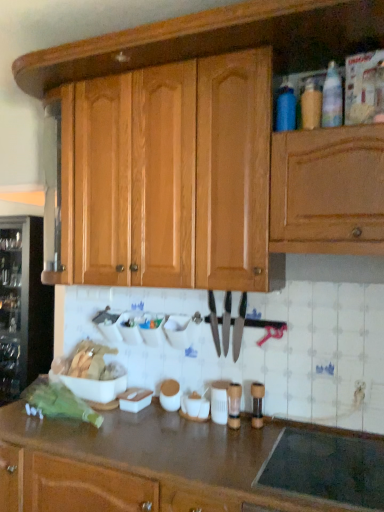
You are a GUI agent. You are given a task and a screenshot of the screen. Output one action in this format:
    pyautogui.click(x=<x>, y=<y>)
    Task: Click on the translucent plastic bottle at upper right, placed as the first bottle when sorted from right to left
    
    Given the screenshot: What is the action you would take?
    pyautogui.click(x=332, y=97)

Measure the distance between translucent plastic bottle at upper right, the 2th bottle in the left-to-right sequence, and camera.

translucent plastic bottle at upper right, the 2th bottle in the left-to-right sequence, is 1.56 meters away from camera.

This screenshot has width=384, height=512. I want to click on shiny silver knife at center, so click(239, 327).

Image resolution: width=384 pixels, height=512 pixels. What do you see at coordinates (214, 322) in the screenshot? I see `shiny silver knife at center, arranged as the first knife when viewed from the left` at bounding box center [214, 322].

Measure the distance between wooden cabinet at upper center and camera.

→ The depth of wooden cabinet at upper center is 5.16 feet.

What are the coordinates of `brown laminate countertop at lower center` in the screenshot? It's located at 182,465.

Which of these two, black metallic knife at center, the 2th knife in the left-to-right sequence, or wooden cabinet at upper center, is bigger?

Bigger between the two is wooden cabinet at upper center.

From the image's perspective, which one is positioned higher, black metallic knife at center, the 2th knife in the left-to-right sequence, or wooden cabinet at upper center?

From the image's view, wooden cabinet at upper center is above.

Would you say black metallic knife at center, the 2th knife in the left-to-right sequence, is inside or outside wooden cabinet at upper center?

black metallic knife at center, the 2th knife in the left-to-right sequence, is not inside wooden cabinet at upper center, it's outside.

Would you say shiny silver knife at center, arranged as the first knife when viewed from the left, is part of wooden cabinet at upper center's contents?

No, shiny silver knife at center, arranged as the first knife when viewed from the left, is located outside of wooden cabinet at upper center.

Which of these two, wooden cabinet at upper center or shiny silver knife at center, which appears as the second knife when viewed from the right, stands taller?

wooden cabinet at upper center.

Does point (108, 98) come in front of point (211, 308)?

Yes, point (108, 98) is closer to viewer.

Would you say wooden cabinet at upper center is a long distance from shiny silver knife at center, arranged as the first knife when viewed from the left?

No, wooden cabinet at upper center is not far from shiny silver knife at center, arranged as the first knife when viewed from the left.

Which of these two, black glass stovetop at lower right or black metallic knife at center, which appears as the first knife when viewed from the right, stands taller?

With more height is black metallic knife at center, which appears as the first knife when viewed from the right.

This screenshot has height=512, width=384. Find the location of `appliance in front of the black metallic knife at center, the 2th knife in the left-to-right sequence`. appliance in front of the black metallic knife at center, the 2th knife in the left-to-right sequence is located at coordinates (327, 467).

Considering the relative sizes of black glass stovetop at lower right and black metallic knife at center, the 2th knife in the left-to-right sequence, in the image provided, is black glass stovetop at lower right wider than black metallic knife at center, the 2th knife in the left-to-right sequence,?

Answer: Indeed, black glass stovetop at lower right has a greater width compared to black metallic knife at center, the 2th knife in the left-to-right sequence.

Who is smaller, black glass stovetop at lower right or black metallic knife at center, the 2th knife in the left-to-right sequence?

black metallic knife at center, the 2th knife in the left-to-right sequence, is smaller.

Is the position of black metallic knife at center, which appears as the first knife when viewed from the right, more distant than that of shiny silver knife at center?

Yes, black metallic knife at center, which appears as the first knife when viewed from the right, is further from the viewer.

How much distance is there between black metallic knife at center, which appears as the first knife when viewed from the right, and shiny silver knife at center?

The distance of black metallic knife at center, which appears as the first knife when viewed from the right, from shiny silver knife at center is 0.98 inches.

From a real-world perspective, which object rests below the other?

shiny silver knife at center.

Considering the positions of objects black metallic knife at center, the 2th knife in the left-to-right sequence, and shiny silver knife at center in the image provided, who is more to the right, black metallic knife at center, the 2th knife in the left-to-right sequence, or shiny silver knife at center?

shiny silver knife at center.

From the image's perspective, is translucent plastic bottle at upper right, the 3th bottle in the left-to-right sequence, located beneath brown laminate countertop at lower center?

Actually, translucent plastic bottle at upper right, the 3th bottle in the left-to-right sequence, appears above brown laminate countertop at lower center in the image.

Which is farther, (335, 101) or (54, 425)?

Point (54, 425)

Is translucent plastic bottle at upper right, placed as the first bottle when sorted from right to left, thinner than brown laminate countertop at lower center?

Yes.

Is translucent plastic bottle at upper right, placed as the first bottle when sorted from right to left, in contact with brown laminate countertop at lower center?

No, translucent plastic bottle at upper right, placed as the first bottle when sorted from right to left, is not making contact with brown laminate countertop at lower center.

Would you say wooden cabinet at upper center is a long distance from shiny silver knife at center?

No, there isn't a large distance between wooden cabinet at upper center and shiny silver knife at center.

How far apart are wooden cabinet at upper center and shiny silver knife at center?

wooden cabinet at upper center is 23.89 inches from shiny silver knife at center.

In the image, is wooden cabinet at upper center positioned in front of or behind shiny silver knife at center?

Clearly, wooden cabinet at upper center is in front of shiny silver knife at center.

From a real-world perspective, who is located higher, translucent plastic bottle at upper right, the second bottle viewed from the right, or shiny silver knife at center, arranged as the first knife when viewed from the left?

In real-world perspective, translucent plastic bottle at upper right, the second bottle viewed from the right, is above.

Is translucent plastic bottle at upper right, the second bottle viewed from the right, wider or thinner than shiny silver knife at center, arranged as the first knife when viewed from the left?

Considering their sizes, translucent plastic bottle at upper right, the second bottle viewed from the right, looks slimmer than shiny silver knife at center, arranged as the first knife when viewed from the left.

Would you say translucent plastic bottle at upper right, the 2th bottle in the left-to-right sequence, is outside shiny silver knife at center, arranged as the first knife when viewed from the left?

translucent plastic bottle at upper right, the 2th bottle in the left-to-right sequence, is positioned outside shiny silver knife at center, arranged as the first knife when viewed from the left.

From the image's perspective, which is above, translucent plastic bottle at upper right, the 2th bottle in the left-to-right sequence, or shiny silver knife at center, arranged as the first knife when viewed from the left?

From the image's view, translucent plastic bottle at upper right, the 2th bottle in the left-to-right sequence, is above.

From a real-world perspective, starting from the wooden cabinet at upper center, which knife is the 2nd one below it? Please provide its 2D coordinates.

[(226, 322)]

Image resolution: width=384 pixels, height=512 pixels. I want to click on cabinetry in front of the shiny silver knife at center, which appears as the second knife when viewed from the right, so click(170, 177).

Looking at the image, which one is located further to shiny silver knife at center, transparent glass wine cooler at left or wooden cabinet at upper center?

transparent glass wine cooler at left is positioned further to the anchor shiny silver knife at center.

Considering their positions, is shiny silver knife at center positioned closer to black glass stovetop at lower right than blue matte bottle at upper right, the first bottle positioned from the left?

shiny silver knife at center.

Looking at the image, which one is located closer to shiny silver knife at center, arranged as the first knife when viewed from the left, shiny silver knife at center or translucent plastic bottle at upper right, the 3th bottle in the left-to-right sequence?

shiny silver knife at center is positioned closer to the anchor shiny silver knife at center, arranged as the first knife when viewed from the left.

Considering their positions, is transparent glass wine cooler at left positioned closer to blue matte bottle at upper right, acting as the third bottle starting from the right, than shiny silver knife at center?

shiny silver knife at center is positioned closer to the anchor blue matte bottle at upper right, acting as the third bottle starting from the right.

Considering their positions, is brown laminate countertop at lower center positioned further to wooden cabinet at upper center than black glass stovetop at lower right?

black glass stovetop at lower right.

When comparing their distances from translucent plastic bottle at upper right, the 3th bottle in the left-to-right sequence, does blue matte bottle at upper right, the first bottle positioned from the left, or shiny silver knife at center, which appears as the second knife when viewed from the right, seem closer?

blue matte bottle at upper right, the first bottle positioned from the left, lies closer to translucent plastic bottle at upper right, the 3th bottle in the left-to-right sequence, than the other object.

From the image, which object appears to be farther from black metallic knife at center, which appears as the first knife when viewed from the right, transparent glass wine cooler at left or black glass stovetop at lower right?

transparent glass wine cooler at left lies further to black metallic knife at center, which appears as the first knife when viewed from the right, than the other object.

Looking at the image, which one is located further to translucent plastic bottle at upper right, placed as the first bottle when sorted from right to left, black glass stovetop at lower right or black metallic knife at center, which appears as the first knife when viewed from the right?

Based on the image, black glass stovetop at lower right appears to be further to translucent plastic bottle at upper right, placed as the first bottle when sorted from right to left.

Find the location of `knife that lies between translucent plastic bottle at upper right, the 2th bottle in the left-to-right sequence, and black metallic knife at center, the 2th knife in the left-to-right sequence, from top to bottom`. knife that lies between translucent plastic bottle at upper right, the 2th bottle in the left-to-right sequence, and black metallic knife at center, the 2th knife in the left-to-right sequence, from top to bottom is located at coordinates (214, 322).

What are the coordinates of `bottle positioned between blue matte bottle at upper right, the first bottle positioned from the left, and transparent glass wine cooler at left from near to far` in the screenshot? It's located at point(310,105).

Where is `bottle between blue matte bottle at upper right, the first bottle positioned from the left, and brown laminate countertop at lower center in the up-down direction`? The height and width of the screenshot is (512, 384). bottle between blue matte bottle at upper right, the first bottle positioned from the left, and brown laminate countertop at lower center in the up-down direction is located at coordinates (310, 105).

This screenshot has height=512, width=384. In order to click on bottle between blue matte bottle at upper right, acting as the third bottle starting from the right, and shiny silver knife at center, which appears as the second knife when viewed from the right, vertically in this screenshot , I will do `click(310, 105)`.